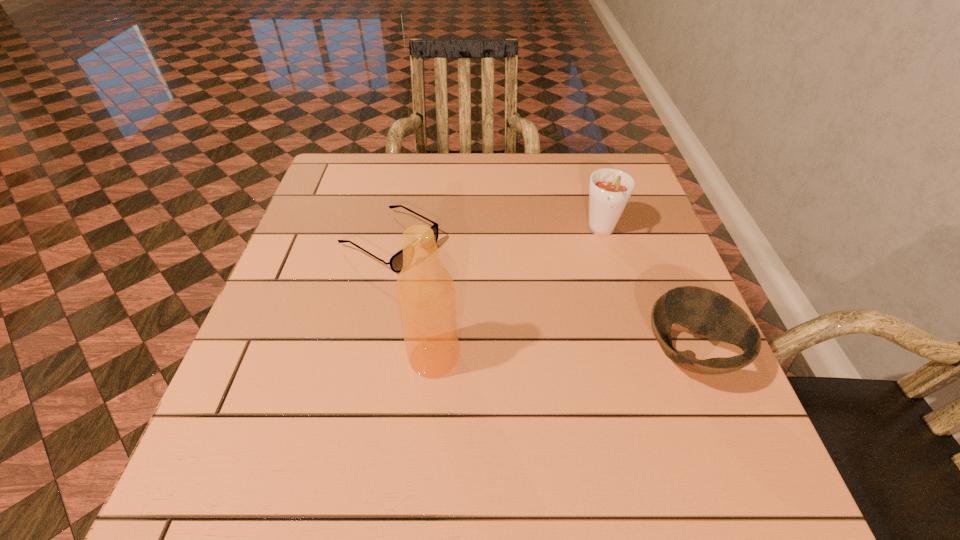
At what (x,y) coordinates should I click in order to perform the action: click on free space on the desktop that is between the tallest object and the second shortest object and is positioned on the drink side of the third shortest object. Please return your answer as a coordinate pair (x, y). This screenshot has height=540, width=960. Looking at the image, I should click on (530, 356).

This screenshot has height=540, width=960. What are the coordinates of `vacant space on the desktop that is between the tallest object and the bowl and is positioned on the front-facing side of the shortest object` in the screenshot? It's located at (589, 355).